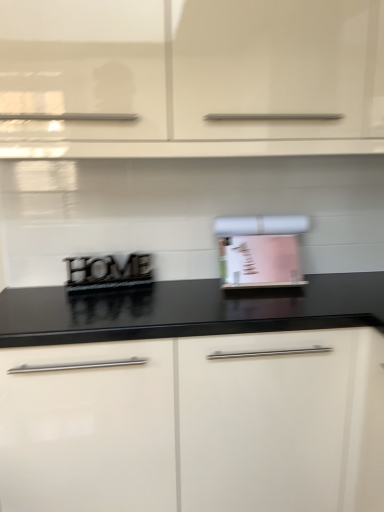
Question: Is metallic black sign at center, the first appliance when ordered from left to right, in front of or behind white glossy cabinet at center, the 1th cabinetry when ordered from bottom to top, in the image?

Choices:
 (A) behind
 (B) front

Answer: (A)

Question: From their relative heights in the image, would you say metallic black sign at center, which ranks as the second appliance in right-to-left order, is taller or shorter than white glossy cabinet at center, the 1th cabinetry when ordered from bottom to top?

Choices:
 (A) short
 (B) tall

Answer: (A)

Question: Estimate the real-world distances between objects in this image. Which object is farther from the pink paper towel holder at center, which appears as the 2th appliance when viewed from the left?

Choices:
 (A) white glossy cabinet at center, the 1th cabinetry when ordered from bottom to top
 (B) white glossy cabinet at upper center, placed as the 2th cabinetry when sorted from bottom to top
 (C) metallic black sign at center, the first appliance when ordered from left to right

Answer: (B)

Question: Which of these objects is positioned farthest from the white glossy cabinet at center, the 1th cabinetry when ordered from bottom to top?

Choices:
 (A) white glossy cabinet at upper center, which is counted as the 1th cabinetry, starting from the top
 (B) pink paper towel holder at center, the first appliance viewed from the right
 (C) metallic black sign at center, the first appliance when ordered from left to right

Answer: (A)